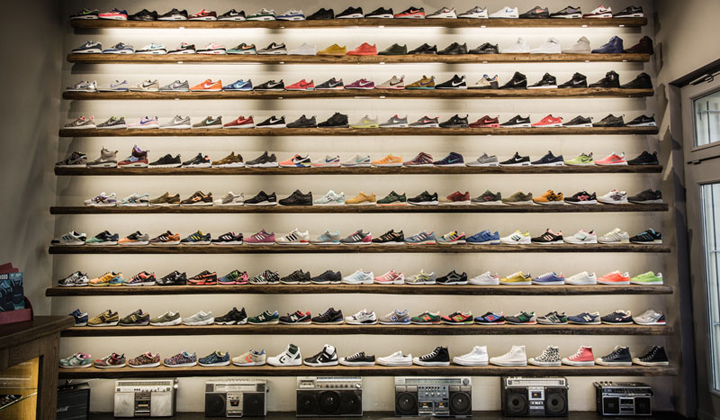
Image resolution: width=720 pixels, height=420 pixels. In order to click on radios in this screenshot , I will do `click(636, 402)`, `click(549, 394)`, `click(441, 398)`, `click(338, 400)`, `click(243, 400)`, `click(161, 400)`, `click(81, 399)`.